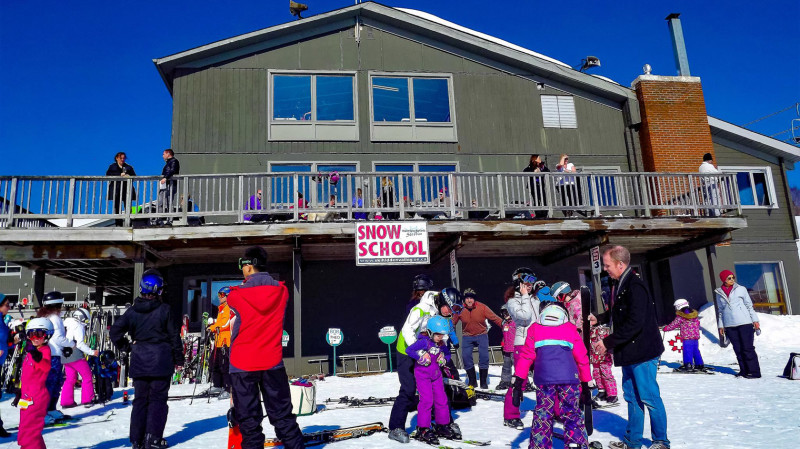
This screenshot has width=800, height=449. Find the location of `windows`. windows is located at coordinates (278, 96), (340, 101), (388, 98), (428, 106).